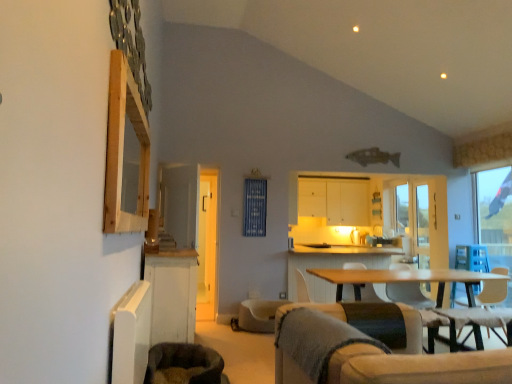
Question: Is light brown wooden table at center situated inside beige fabric swivel chair at center, which is the 1th swivel chair in right-to-left order, or outside?

Choices:
 (A) inside
 (B) outside

Answer: (B)

Question: From the image's perspective, is light brown wooden table at center above or below beige fabric swivel chair at center, arranged as the second swivel chair when viewed from the left?

Choices:
 (A) above
 (B) below

Answer: (A)

Question: Which is farther from the white fabric armchair at center?

Choices:
 (A) blue fabric curtain at center
 (B) light brown wooden table at center
 (C) beige fabric swivel chair at center, which is the 1th swivel chair in right-to-left order
 (D) white matte cabinet at upper center, placed as the second cabinetry when sorted from front to back
 (E) white wood cabinet at lower left, the first cabinetry positioned from the front

Answer: (B)

Question: Which of these objects is positioned farthest from the light brown wooden table at center?

Choices:
 (A) white matte cabinet at upper center, arranged as the second cabinetry when ordered from the bottom
 (B) transparent glass window at right
 (C) white wood cabinet at lower left, the 1th cabinetry positioned from the bottom
 (D) blue fabric curtain at center
 (E) white fabric armchair at center

Answer: (C)